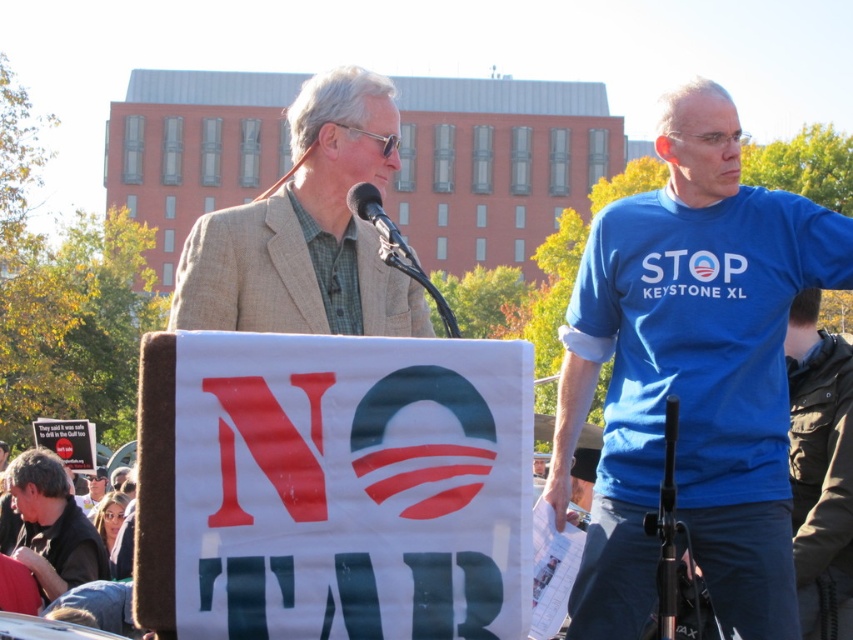
Question: Which point appears farthest from the camera in this image?

Choices:
 (A) (329, 225)
 (B) (51, 512)

Answer: (B)

Question: Is beige textured blazer at center wider than metallic/microphone at center?

Choices:
 (A) yes
 (B) no

Answer: (A)

Question: Which is nearer to the beige textured blazer at center?

Choices:
 (A) metallic/microphone at center
 (B) dark brown leather jacket at lower left
 (C) blue cotton t-shirt at right
 (D) dark brown leather jacket at lower right

Answer: (A)

Question: From the image, what is the correct spatial relationship of beige textured blazer at center in relation to dark brown leather jacket at lower left?

Choices:
 (A) above
 (B) below

Answer: (A)

Question: Is beige textured blazer at center closer to camera compared to metallic/microphone at center?

Choices:
 (A) yes
 (B) no

Answer: (B)

Question: Which point appears farthest from the camera in this image?

Choices:
 (A) (833, 564)
 (B) (12, 556)
 (C) (380, 230)
 (D) (376, 182)

Answer: (B)